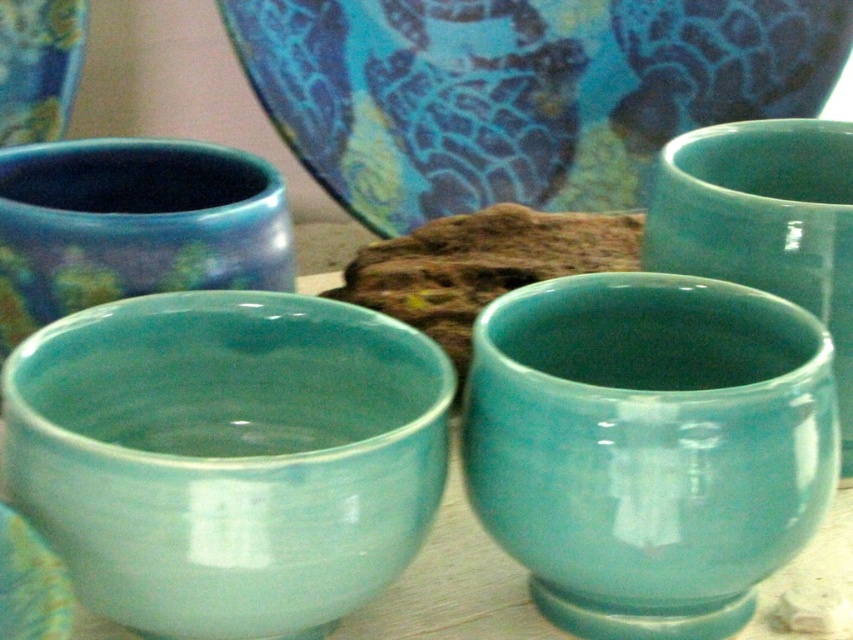
You are an interior designer arranging items on a table. You need to place a decorative item at point (227, 456). Which object from the scene is already at that location?

The matte ceramic bowl at center is located at point (227, 456).

You are an interior designer arranging items on a table. You have a matte ceramic bowl at center and a matte ceramic cup at center. If you want to place a small vase between them, where should you position it to ensure it is equidistant from both?

The matte ceramic bowl at center is closer to the viewer than the matte ceramic cup at center. To place the vase equidistant between them, position it closer to the matte ceramic bowl at center since it is nearer to the viewer compared to the matte ceramic cup at center.